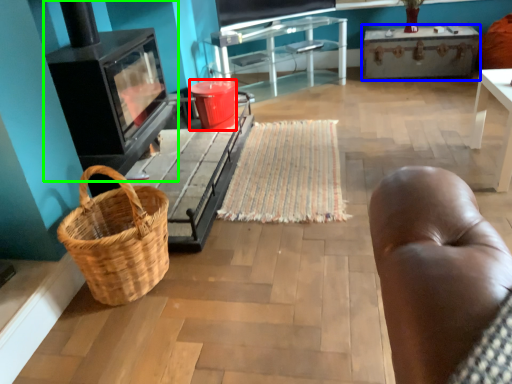
Question: Which object is the farthest from bucket (highlighted by a red box)? Choose among these: table (highlighted by a blue box) or stove (highlighted by a green box).

Choices:
 (A) table
 (B) stove

Answer: (A)